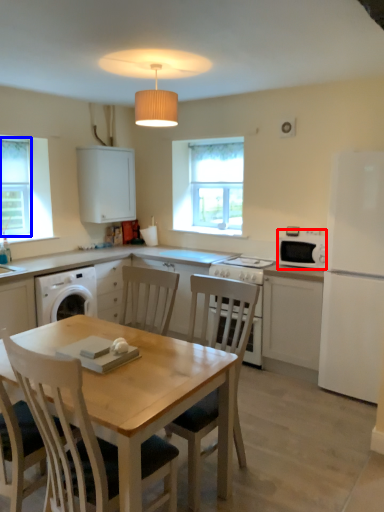
Question: Which object is further to the camera taking this photo, microwave oven (highlighted by a red box) or window screen (highlighted by a blue box)?

Choices:
 (A) microwave oven
 (B) window screen

Answer: (B)